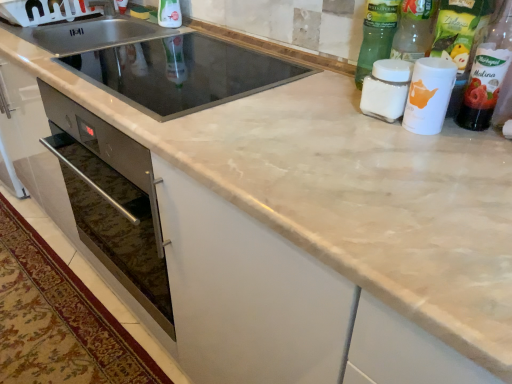
Image resolution: width=512 pixels, height=384 pixels. I want to click on vacant area that is in front of white matte cup at upper right, which ranks as the 3th bottle in right-to-left order, so click(436, 160).